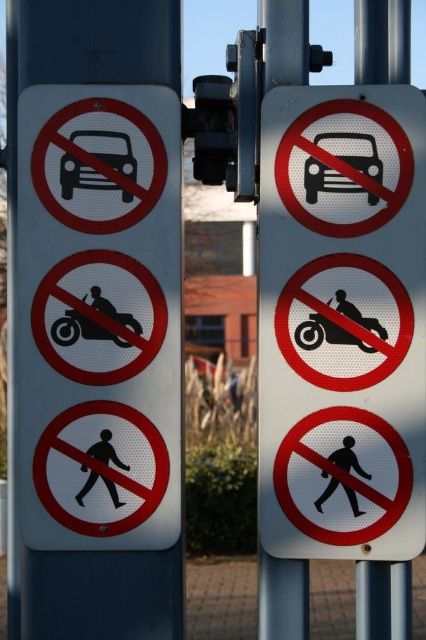
Question: Which point is closer to the camera?

Choices:
 (A) (264, 65)
 (B) (301, 298)
 (C) (94, 310)
 (D) (316, 164)

Answer: (C)

Question: Is black matte motorcycle at center positioned at the back of black textured motorcycle at center?

Choices:
 (A) yes
 (B) no

Answer: (B)

Question: Which of the following is the farthest from the observer?

Choices:
 (A) pos(310,298)
 (B) pos(385,547)
 (C) pos(298,579)
 (D) pos(115,323)

Answer: (C)

Question: Estimate the real-world distances between objects in this image. Which object is closer to the white metallic sign at left?

Choices:
 (A) metallic pole at center
 (B) white plastic sign at center
 (C) metallic traffic light at center
 (D) black matte motorcycle at center

Answer: (C)

Question: Is black glossy car at upper left further to the viewer compared to black matte motorcycle at center?

Choices:
 (A) yes
 (B) no

Answer: (A)

Question: Where is metallic silver car at center located in relation to metallic pole at center in the image?

Choices:
 (A) above
 (B) below

Answer: (A)